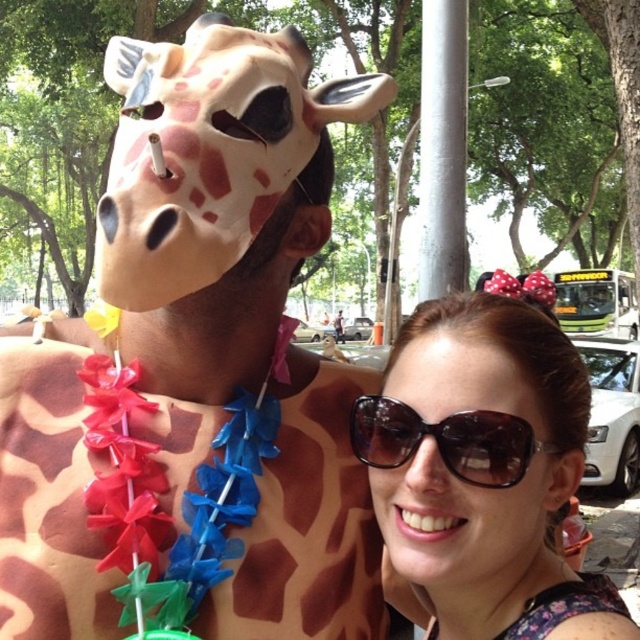
Is point (566, 480) positioned in front of point (452, 193)?

That is True.

Is point (524, 589) more distant than point (436, 131)?

No.

Between point (552, 387) and point (444, 108), which one is positioned behind?

Point (444, 108)

Where is `matte black sunglasses at upper center`? This screenshot has height=640, width=640. matte black sunglasses at upper center is located at coordinates click(x=483, y=470).

Can you confirm if brown matte giraffe mask at upper left is shorter than matte black sunglasses at upper center?

No.

Is brown matte giraffe mask at upper left further to the viewer compared to matte black sunglasses at upper center?

Yes, brown matte giraffe mask at upper left is further from the viewer.

Between point (326, 152) and point (428, 314), which one is positioned behind?

Positioned behind is point (326, 152).

At what (x,y) coordinates should I click in order to perform the action: click on brown matte giraffe mask at upper left. Please return your answer as a coordinate pair (x, y). The image size is (640, 640). Looking at the image, I should click on (195, 368).

Who is shorter, brown matte giraffe mask at upper left or brown matte sunglasses at center?

brown matte sunglasses at center

Locate an element on the screen. The image size is (640, 640). brown matte giraffe mask at upper left is located at coordinates tap(195, 368).

Locate an element on the screen. The image size is (640, 640). brown matte giraffe mask at upper left is located at coordinates [x=195, y=368].